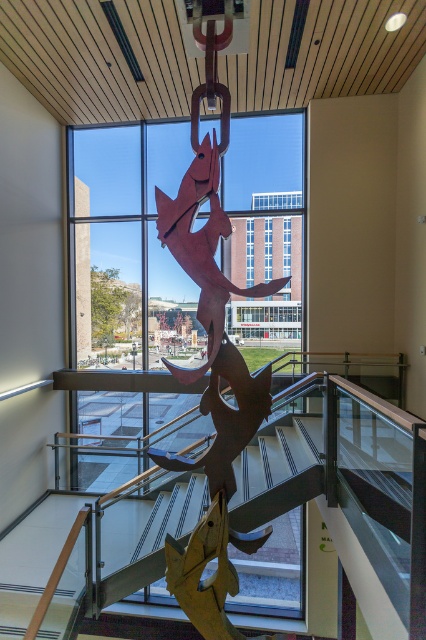
Is point (100, 228) positioned before point (189, 499)?

No, (100, 228) is behind (189, 499).

Can you confirm if wooden fish at center is positioned below metallic staircase at center?

No.

Is point (255, 192) more distant than point (264, 476)?

Yes, point (255, 192) is behind point (264, 476).

Where is `wooden fish at center`? The width and height of the screenshot is (426, 640). wooden fish at center is located at coordinates (131, 246).